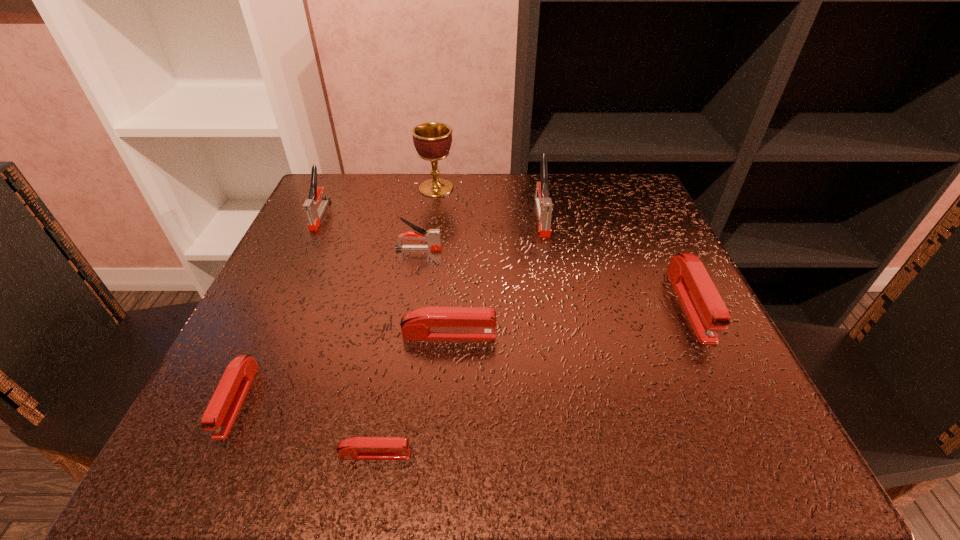
Where is `the third shortest stapler`? This screenshot has height=540, width=960. the third shortest stapler is located at coordinates (428, 323).

This screenshot has width=960, height=540. I want to click on the third smallest red stapler, so click(428, 323).

Where is `the second nearest stapler`? the second nearest stapler is located at coordinates (220, 414).

Locate an element on the screen. the leftmost red stapler is located at coordinates click(x=220, y=414).

Where is `the nearest object`? This screenshot has height=540, width=960. the nearest object is located at coordinates (357, 448).

Locate an element on the screen. The width and height of the screenshot is (960, 540). the nearest stapler is located at coordinates (357, 448).

Image resolution: width=960 pixels, height=540 pixels. What are the coordinates of `vacant space located on the front of the chalice` in the screenshot? It's located at (431, 226).

Image resolution: width=960 pixels, height=540 pixels. I want to click on vacant region located on the handle side of the biggest gray stapler, so click(x=569, y=369).

You are a GUI agent. You are given a task and a screenshot of the screen. Output one action in this format:
    pyautogui.click(x=<x>, y=<y>)
    Task: Click on the free region located on the handle side of the sixth shortest stapler
    The width and height of the screenshot is (960, 540).
    Given the screenshot: What is the action you would take?
    pyautogui.click(x=262, y=337)

Identify the location of free spot located 0.070m on the handle side of the fourth farthest object. point(476,249).